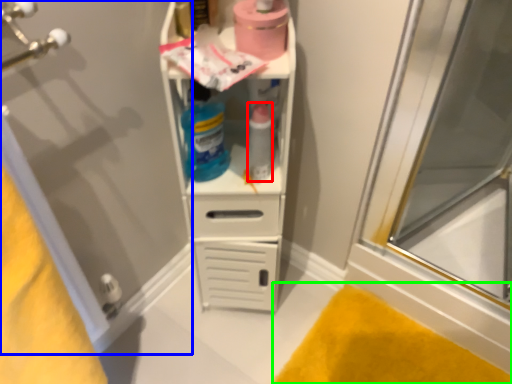
Question: Estimate the real-world distances between objects in this image. Which object is closer to bottle (highlighted by a red box), screen door (highlighted by a blue box) or bath mat (highlighted by a green box)?

Choices:
 (A) screen door
 (B) bath mat

Answer: (A)